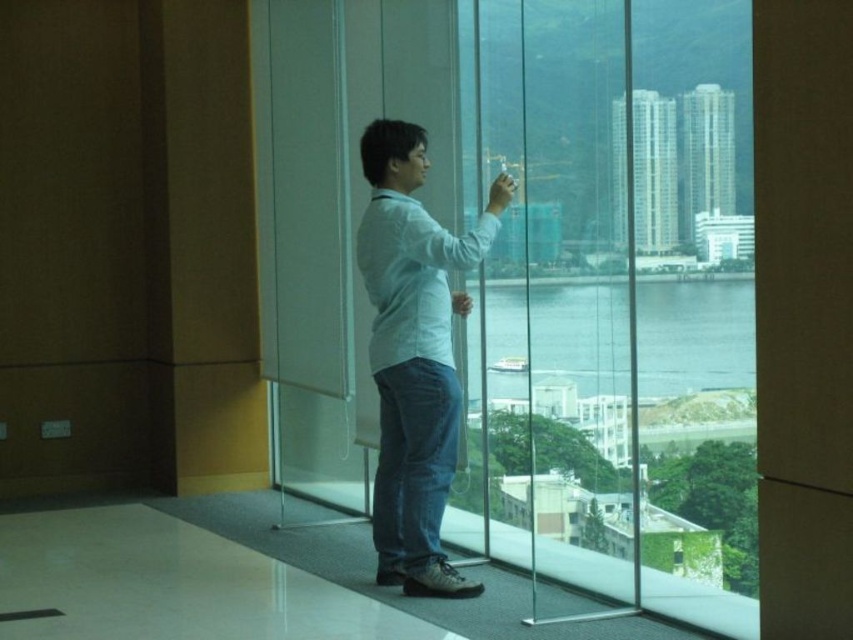
You are a delivery person who needs to place a box on the floor between the transparent glass door at center and the light blue denim jeans at center. The box requires 12 inches of space to fit. Is there enough space between them?

The transparent glass door at center is 32.55 inches from the light blue denim jeans at center. Since the required space is 12 inches, the distance between them is sufficient to accommodate the box.

You are trying to exit through the transparent glass door at center while wearing the light blue denim jeans at center. Will your jeans fit through the door without getting caught?

The transparent glass door at center is wider than the light blue denim jeans at center, so your jeans will fit through the door without getting caught.